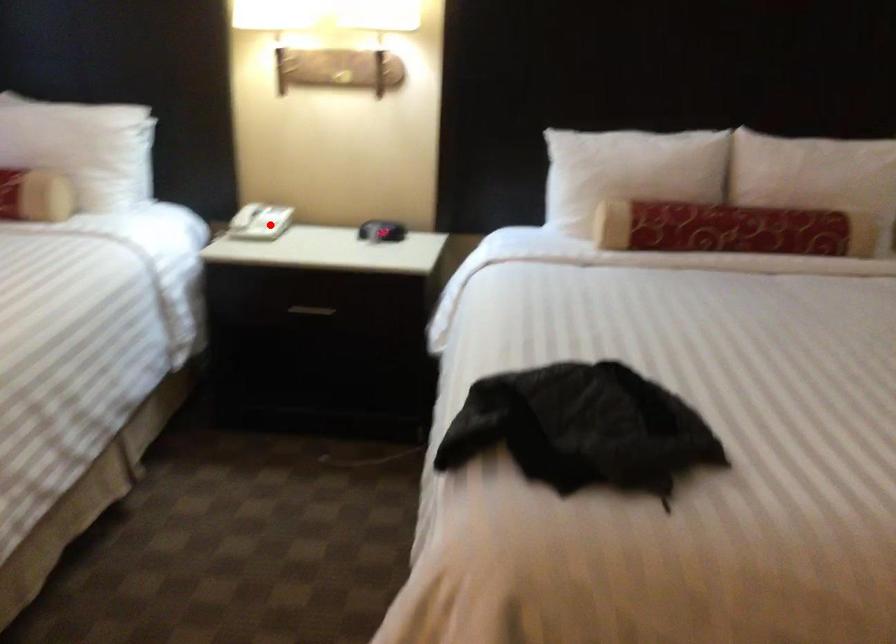
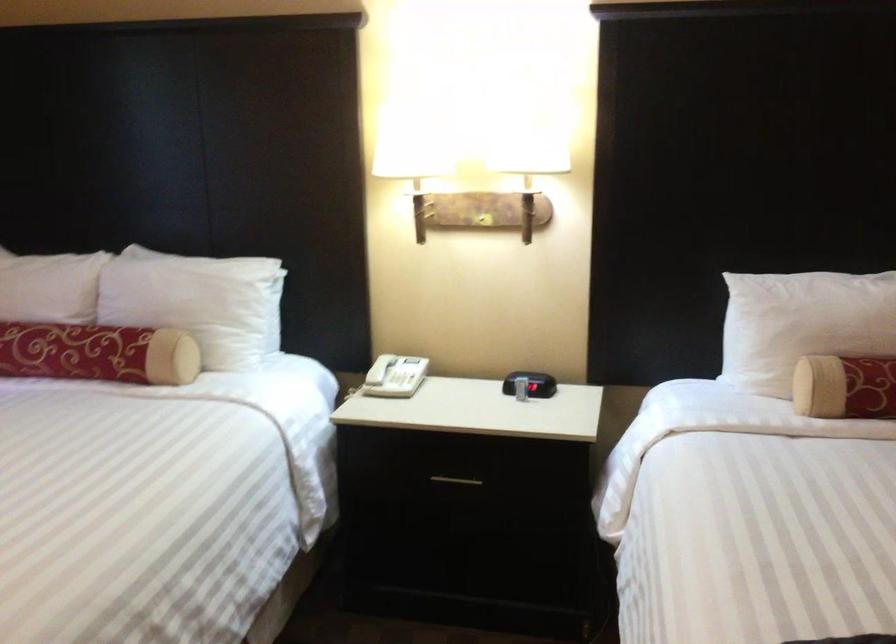
Question: I am providing you with two images of the same scene from different viewpoints. A red point is shown in image1. For the corresponding object point in image2, is it positioned nearer or farther from the camera?

Choices:
 (A) Nearer
 (B) Farther

Answer: (A)